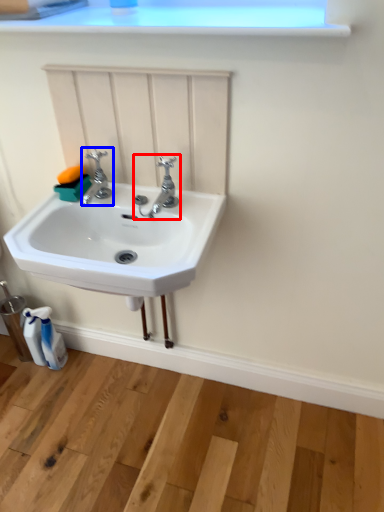
Question: Among these objects, which one is farthest to the camera, tap (highlighted by a red box) or tap (highlighted by a blue box)?

Choices:
 (A) tap
 (B) tap

Answer: (B)